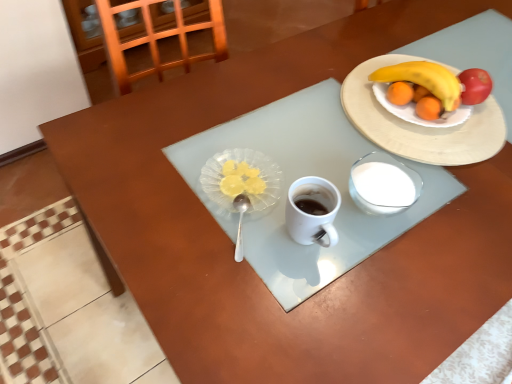
Image resolution: width=512 pixels, height=384 pixels. I want to click on free space to the back side of silver metallic spoon at center, so click(x=246, y=155).